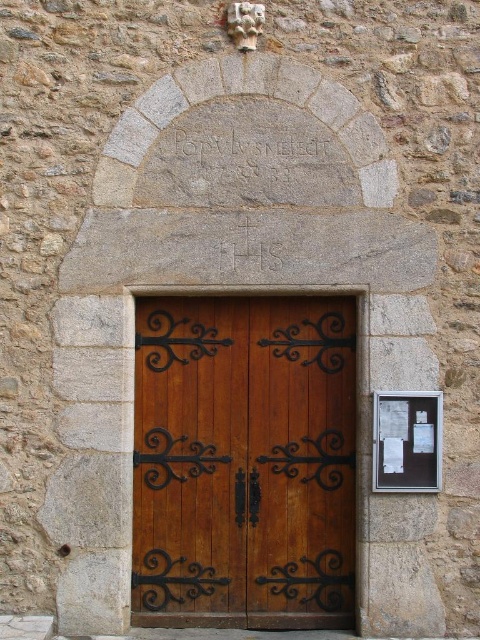
Is wooden door at center thinner than carved stone inscription at center?

Incorrect, wooden door at center's width is not less than carved stone inscription at center's.

Which of these two, wooden door at center or carved stone inscription at center, stands shorter?

carved stone inscription at center

Is point (300, 371) positioned in front of point (277, 157)?

No, it is not.

The image size is (480, 640). I want to click on wooden door at center, so click(x=243, y=461).

Which is below, carved stone inscription at center or white paper noticeboard at right?

white paper noticeboard at right is lower down.

Is carved stone inscription at center closer to camera compared to white paper noticeboard at right?

No, carved stone inscription at center is behind white paper noticeboard at right.

Which is in front, point (199, 173) or point (408, 403)?

Point (408, 403) is in front.

Locate an element on the screen. carved stone inscription at center is located at coordinates (256, 156).

Which is more to the left, wooden door at center or white paper noticeboard at right?

wooden door at center is more to the left.

In the scene shown: Is wooden door at center positioned before white paper noticeboard at right?

No, it is behind white paper noticeboard at right.

Which is in front, point (162, 394) or point (412, 440)?

Point (412, 440) is in front.

At what (x,y) coordinates should I click in order to perform the action: click on wooden door at center. Please return your answer as a coordinate pair (x, y). The image size is (480, 640). Looking at the image, I should click on (243, 461).